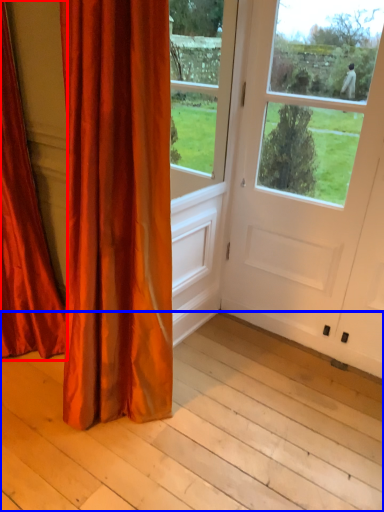
Question: Among these objects, which one is farthest to the camera, curtain (highlighted by a red box) or plank (highlighted by a blue box)?

Choices:
 (A) curtain
 (B) plank

Answer: (A)